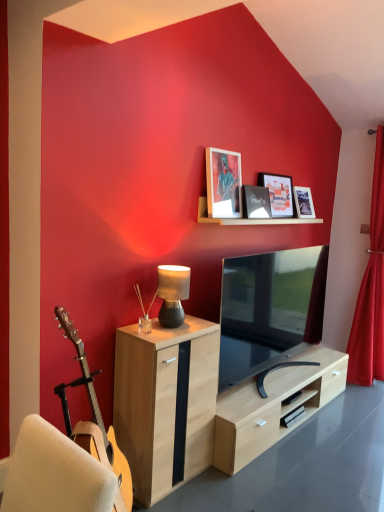
Question: From their relative heights in the image, would you say light wood cabinet at center is taller or shorter than red velvet curtain at right?

Choices:
 (A) short
 (B) tall

Answer: (A)

Question: In the image, is light wood cabinet at center positioned in front of or behind red velvet curtain at right?

Choices:
 (A) front
 (B) behind

Answer: (A)

Question: Which object is positioned closest to the matte black picture frame at upper center, placed as the second picture frame when sorted from right to left?

Choices:
 (A) wooden shelf at upper center
 (B) matte glass picture frame at upper center, arranged as the 4th picture frame when viewed from the right
 (C) matte black lamp at center
 (D) matte black picture frame at upper center, which is the 3th picture frame in right-to-left order
 (E) matte black tv at center

Answer: (D)

Question: Based on their relative distances, which object is nearer to the light wood cabinet at center?

Choices:
 (A) matte glass picture frame at upper center, arranged as the 4th picture frame when viewed from the right
 (B) beech wood desk at lower center
 (C) red velvet curtain at right
 (D) matte black picture frame at upper center, which is the 3th picture frame in right-to-left order
 (E) matte black picture frame at upper center, marked as the 3th picture frame in a left-to-right arrangement

Answer: (B)